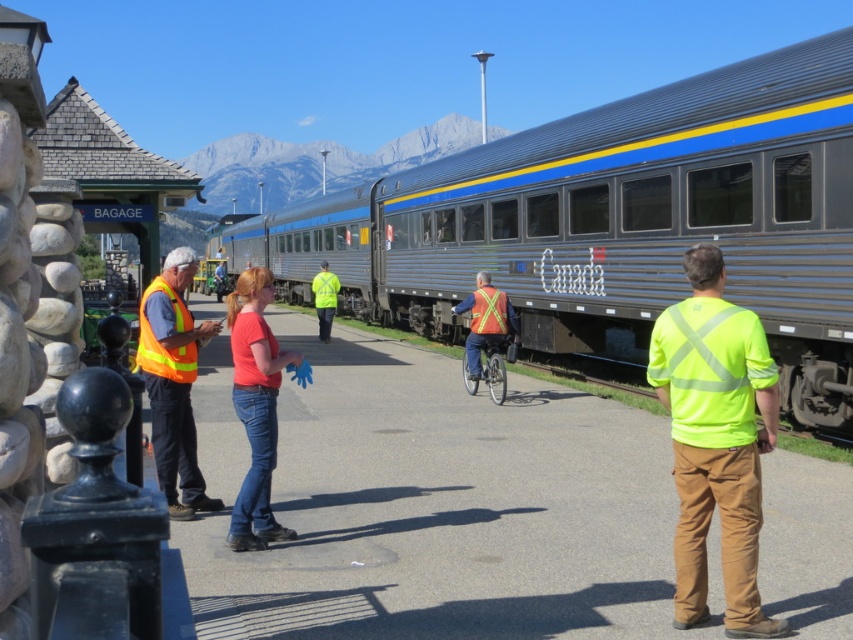
Does metallic silver train at center have a greater width compared to high visibility yellow safety vest at center?

Correct, the width of metallic silver train at center exceeds that of high visibility yellow safety vest at center.

Measure the distance between metallic silver train at center and high visibility yellow safety vest at center.

metallic silver train at center and high visibility yellow safety vest at center are 9.78 meters apart.

Who is more forward, [592,220] or [321,316]?

Point [592,220]

Where is `metallic silver train at center`? The image size is (853, 640). metallic silver train at center is located at coordinates (618, 221).

At what (x,y) coordinates should I click in order to perform the action: click on hi-visibility orange safety vest at left. Please return your answer as a coordinate pair (x, y). The height and width of the screenshot is (640, 853). Looking at the image, I should click on 161,344.

Is point (140, 316) positioned before point (492, 305)?

Yes, it is.

Where is `hi-visibility orange safety vest at left`? hi-visibility orange safety vest at left is located at coordinates (161, 344).

Which is behind, point (144, 304) or point (322, 326)?

Positioned behind is point (322, 326).

Is orange reflective vest at center taller than high visibility yellow safety vest at center?

No.

Who is more distant from viewer, (180, 392) or (328, 317)?

Point (328, 317)

The image size is (853, 640). Identify the location of orange reflective vest at center. (173, 381).